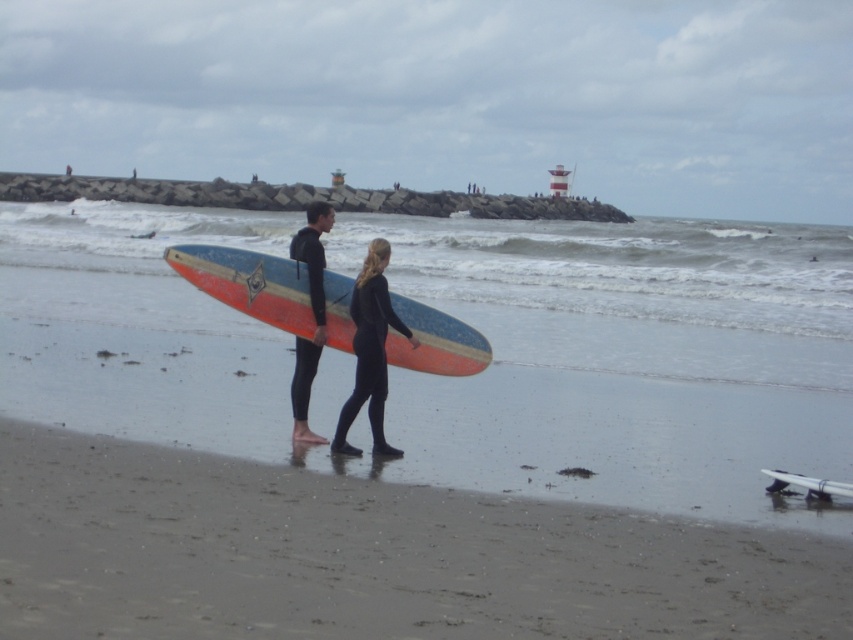
You are a photographer positioned at the origin point of the coordinate system. You want to take a photo of the matte wood surfboard at center. What are the coordinates of the surfboard?

The coordinates of the matte wood surfboard at center are at point (389, 490).

You are a photographer trying to capture the two people on the beach. You want to ensure both the wooden surfboard at center and the black matte wetsuit at center are clearly visible in your shot. Since the surfboard is larger, which object should you focus on first to ensure proper framing?

The wooden surfboard at center is larger in size than the black matte wetsuit at center, so you should focus on the wooden surfboard at center first to ensure it fits well within the frame before adjusting for the smaller wetsuit.

You are a photographer aiming to capture both the black matte wetsuit at center and the black wetsuit at center in a single frame. Since the camera can only focus on one subject at a time, which one should you choose to ensure the smaller one is in focus?

The black matte wetsuit at center has a smaller size compared to the black wetsuit at center, so you should focus on the black matte wetsuit at center to ensure the smaller one is in focus.